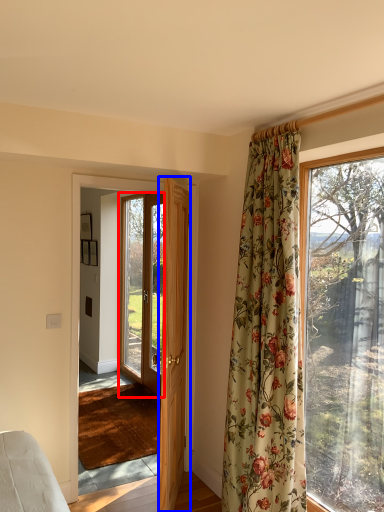
Question: Which object is closer to the camera taking this photo, door (highlighted by a red box) or door (highlighted by a blue box)?

Choices:
 (A) door
 (B) door

Answer: (B)